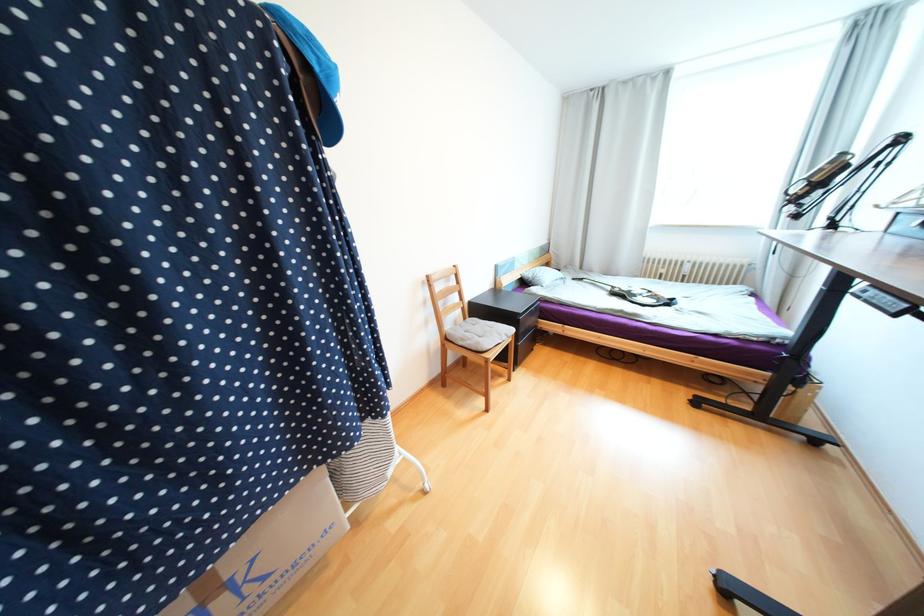
The location [313,71] corresponds to which object?

It corresponds to the blue baseball cap in the image.